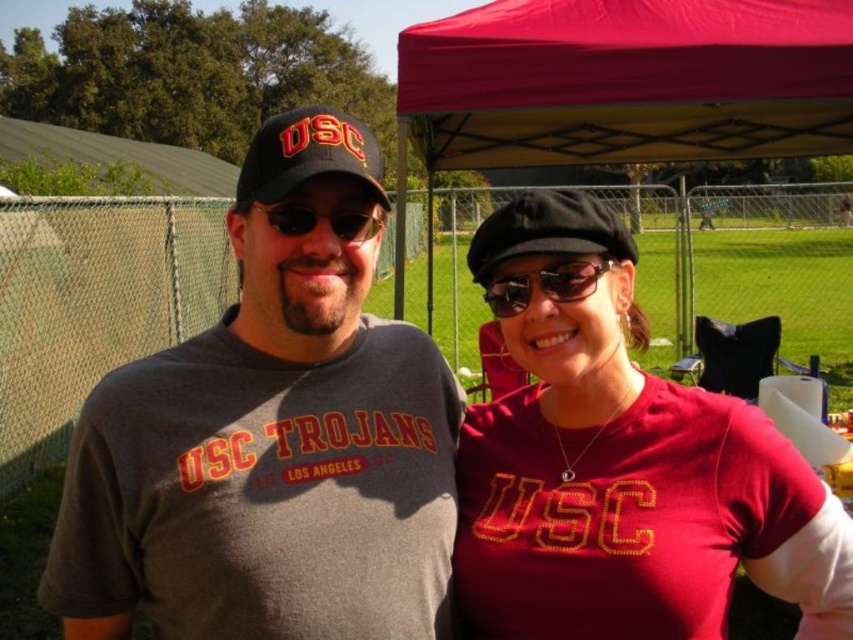
Between black matte baseball cap at upper left and black fabric baseball cap at center, which one has less height?

black fabric baseball cap at center

Is black matte baseball cap at upper left shorter than black fabric baseball cap at center?

No, black matte baseball cap at upper left is not shorter than black fabric baseball cap at center.

At what (x,y) coordinates should I click in order to perform the action: click on black matte baseball cap at upper left. Please return your answer as a coordinate pair (x, y). Looking at the image, I should click on (308, 154).

Does gray matte t-shirt at center appear on the right side of red fabric canopy at upper center?

In fact, gray matte t-shirt at center is to the left of red fabric canopy at upper center.

Between point (392, 362) and point (730, 154), which one is positioned behind?

Positioned behind is point (730, 154).

The width and height of the screenshot is (853, 640). Identify the location of gray matte t-shirt at center. (271, 440).

Does matte red canopy at upper center appear on the left side of black reflective sunglasses at center?

In fact, matte red canopy at upper center is to the right of black reflective sunglasses at center.

Is matte red canopy at upper center taller than black reflective sunglasses at center?

Yes.

Locate an element on the screen. The width and height of the screenshot is (853, 640). matte red canopy at upper center is located at coordinates (627, 81).

Identify the location of matte red canopy at upper center. (627, 81).